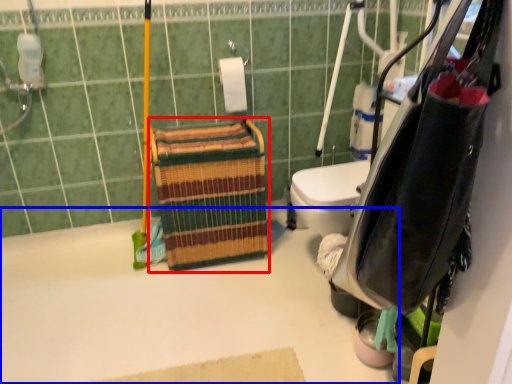
Question: Among these objects, which one is nearest to the camera, basket (highlighted by a red box) or bath (highlighted by a blue box)?

Choices:
 (A) basket
 (B) bath

Answer: (B)